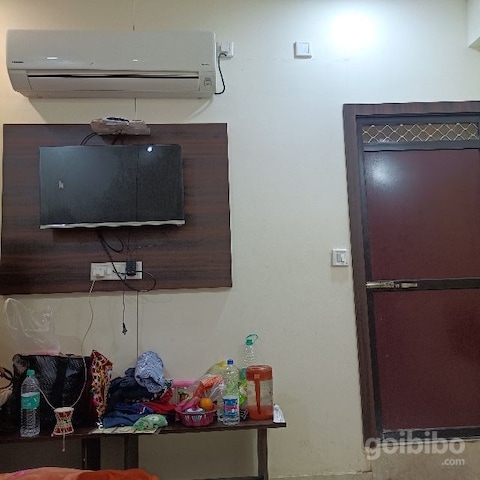
Where is `space above aircon`? The height and width of the screenshot is (480, 480). space above aircon is located at coordinates (110, 17).